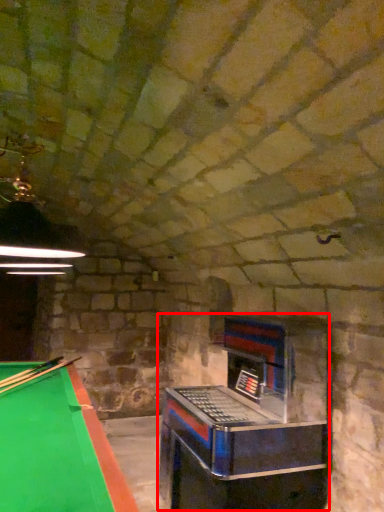
Question: From the image's perspective, what is the correct spatial positioning of slot machine (annotated by the red box) in reference to cue?

Choices:
 (A) below
 (B) above

Answer: (A)